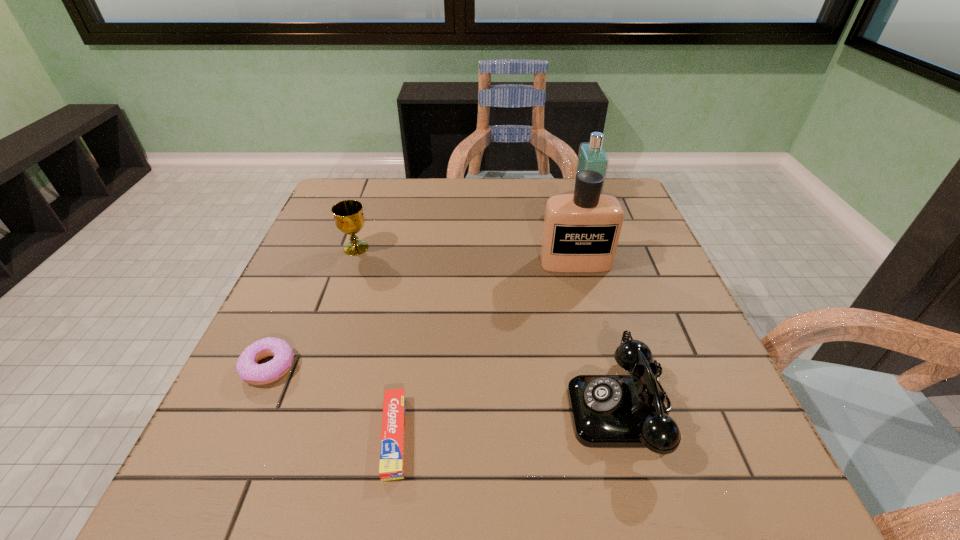
In order to click on free region at the right edge of the desktop in this screenshot , I will do `click(619, 269)`.

Identify the location of vacant space at the far left corner. The image size is (960, 540). 328,199.

The width and height of the screenshot is (960, 540). Find the location of `vacant point located between the tallest object and the telephone`. vacant point located between the tallest object and the telephone is located at coordinates (599, 335).

Find the location of a particular element. The width and height of the screenshot is (960, 540). vacant space in between the chalice and the third object from left to right is located at coordinates (375, 342).

I want to click on empty space between the telephone and the chalice, so click(489, 328).

Identify the location of free area in between the farther perfume and the doughnut. (428, 281).

Image resolution: width=960 pixels, height=540 pixels. Find the location of `vacant area that lies between the doughnut and the fourth object from right to left`. vacant area that lies between the doughnut and the fourth object from right to left is located at coordinates [332, 401].

Where is `free space between the telephone and the toothpaste`? free space between the telephone and the toothpaste is located at coordinates (508, 422).

Find the location of a particular element. The width and height of the screenshot is (960, 540). free space between the tallest object and the chalice is located at coordinates (466, 255).

Where is `vacant space that's between the telephone and the shortest object`? This screenshot has width=960, height=540. vacant space that's between the telephone and the shortest object is located at coordinates (508, 422).